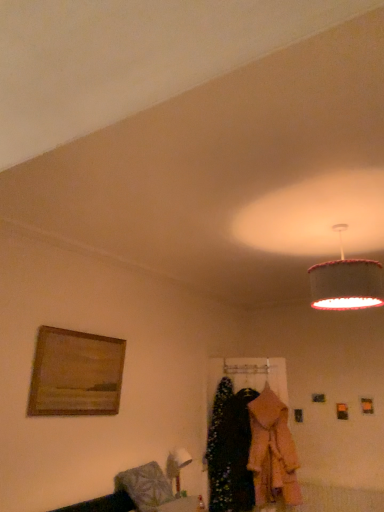
Question: Does velvet black dress at center, which is the 1th clothing from left to right, have a smaller size compared to wooden framed painting at left?

Choices:
 (A) no
 (B) yes

Answer: (A)

Question: Does velvet black dress at center, which is the 1th clothing from left to right, have a lesser height compared to wooden framed painting at left?

Choices:
 (A) no
 (B) yes

Answer: (A)

Question: From a real-world perspective, is velvet black dress at center, which is the 1th clothing from left to right, located beneath wooden framed painting at left?

Choices:
 (A) yes
 (B) no

Answer: (A)

Question: Considering the relative positions of velvet black dress at center, which is the 1th clothing from left to right, and wooden framed painting at left in the image provided, is velvet black dress at center, which is the 1th clothing from left to right, to the right of wooden framed painting at left from the viewer's perspective?

Choices:
 (A) yes
 (B) no

Answer: (A)

Question: Is velvet black dress at center, which is the 1th clothing from left to right, positioned with its back to wooden framed painting at left?

Choices:
 (A) yes
 (B) no

Answer: (B)

Question: From the image's perspective, is textured fabric lampshade at upper right above or below wooden framed painting at left?

Choices:
 (A) above
 (B) below

Answer: (A)

Question: Considering the positions of textured fabric lampshade at upper right and wooden framed painting at left in the image, is textured fabric lampshade at upper right taller or shorter than wooden framed painting at left?

Choices:
 (A) tall
 (B) short

Answer: (B)

Question: Is textured fabric lampshade at upper right inside the boundaries of wooden framed painting at left, or outside?

Choices:
 (A) inside
 (B) outside

Answer: (B)

Question: Considering their positions, is textured fabric lampshade at upper right located in front of or behind wooden framed painting at left?

Choices:
 (A) behind
 (B) front

Answer: (B)

Question: From a real-world perspective, is velvet black dress at center, which is the 1th clothing from left to right, above or below textured fabric lampshade at upper right?

Choices:
 (A) below
 (B) above

Answer: (A)

Question: Looking at their shapes, would you say velvet black dress at center, marked as the 2th clothing in a right-to-left arrangement, is wider or thinner than textured fabric lampshade at upper right?

Choices:
 (A) thin
 (B) wide

Answer: (A)

Question: Relative to textured fabric lampshade at upper right, is velvet black dress at center, marked as the 2th clothing in a right-to-left arrangement, in front or behind?

Choices:
 (A) behind
 (B) front

Answer: (A)

Question: From the image's perspective, is velvet black dress at center, marked as the 2th clothing in a right-to-left arrangement, positioned above or below textured fabric lampshade at upper right?

Choices:
 (A) below
 (B) above

Answer: (A)

Question: Is velvet black dress at center, which is the 1th clothing from left to right, bigger or smaller than wooden framed painting at left?

Choices:
 (A) big
 (B) small

Answer: (A)

Question: From a real-world perspective, relative to wooden framed painting at left, is velvet black dress at center, marked as the 2th clothing in a right-to-left arrangement, vertically above or below?

Choices:
 (A) above
 (B) below

Answer: (B)